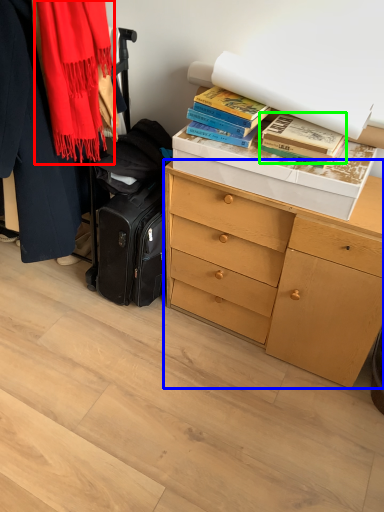
Question: Considering the real-world distances, which object is farthest from scarf (highlighted by a red box)? chest of drawers (highlighted by a blue box) or book (highlighted by a green box)?

Choices:
 (A) chest of drawers
 (B) book

Answer: (A)